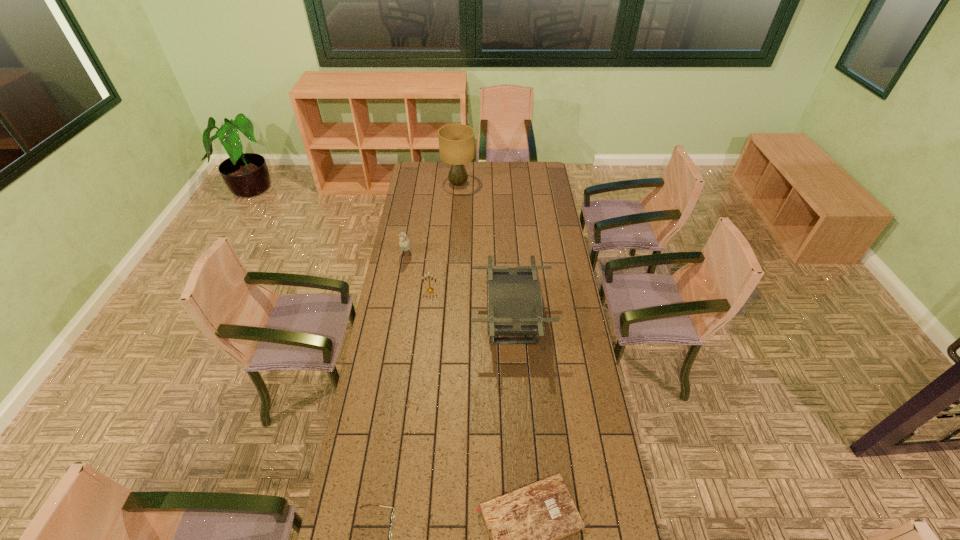
Identify the location of blank space located 0.100m at the face of the fifth nearest object. This screenshot has width=960, height=540. (402, 279).

This screenshot has width=960, height=540. I want to click on vacant space located on the back of the candelabrum, so click(433, 267).

Identify the location of object at the far edge. (456, 141).

The height and width of the screenshot is (540, 960). What are the coordinates of `object positioned at the left edge` in the screenshot? It's located at (404, 242).

I want to click on object present at the right edge, so click(x=514, y=299).

The width and height of the screenshot is (960, 540). Find the location of `vacant space at the far edge of the desktop`. vacant space at the far edge of the desktop is located at coordinates (521, 163).

The width and height of the screenshot is (960, 540). Find the location of `vacant area at the left edge of the desktop`. vacant area at the left edge of the desktop is located at coordinates (421, 237).

Where is `blank space at the right edge of the desktop`? The width and height of the screenshot is (960, 540). blank space at the right edge of the desktop is located at coordinates (579, 491).

Identify the location of vacant space at the far right corner of the desktop. Image resolution: width=960 pixels, height=540 pixels. (544, 167).

Where is `free space between the lampshade and the third tallest object`? This screenshot has height=540, width=960. free space between the lampshade and the third tallest object is located at coordinates (432, 220).